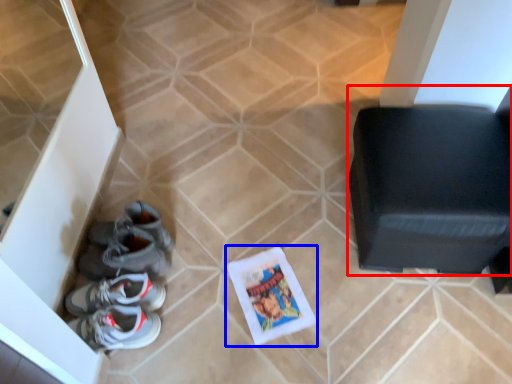
Question: Among these objects, which one is farthest to the camera, furniture (highlighted by a red box) or comic book (highlighted by a blue box)?

Choices:
 (A) furniture
 (B) comic book

Answer: (B)